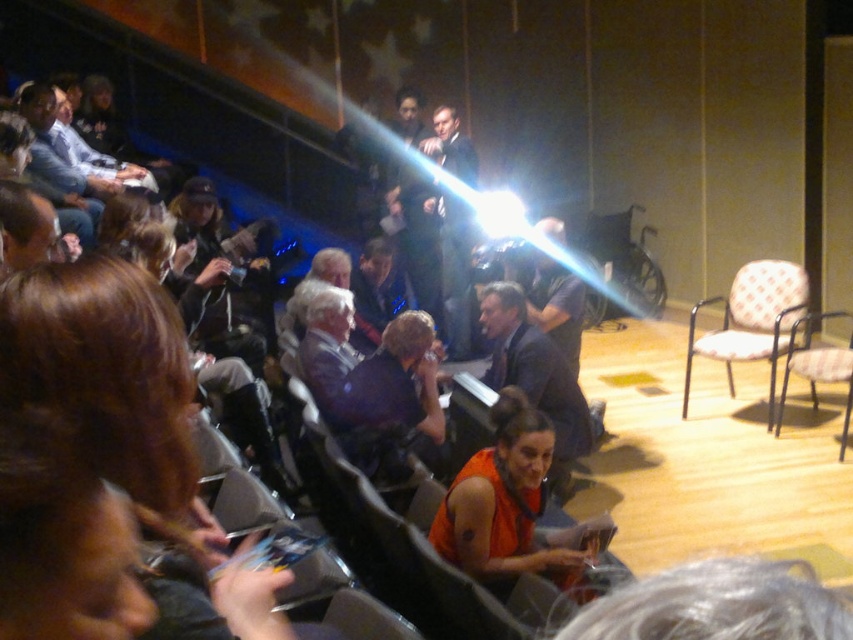
In the theater scene, there is a point marked at coordinates (x=511, y=508). What object or clothing item is located at that specific coordinate?

The point at coordinates (x=511, y=508) corresponds to the orange fabric tank top at center.

In the theater scene, you are standing at point (253, 483) and want to move to point (548, 538). Considering the tiered seating arrangement, will you have to walk uphill or downhill?

Since point (548, 538) is behind point (253, 483) in the theater scene, and the seating is tiered, you would need to walk uphill to reach it.

You are sitting in the theater and want to hand a note to the person wearing the orange fabric tank top at center without being noticed by the person sitting in the white fabric chair at right. Can you do this while staying in your current seat?

The orange fabric tank top at center is in front of the white fabric chair at right, so you can hand the note to the person wearing the orange fabric tank top at center without the person in the white fabric chair at right noticing since the tank top wearer is blocking the view.